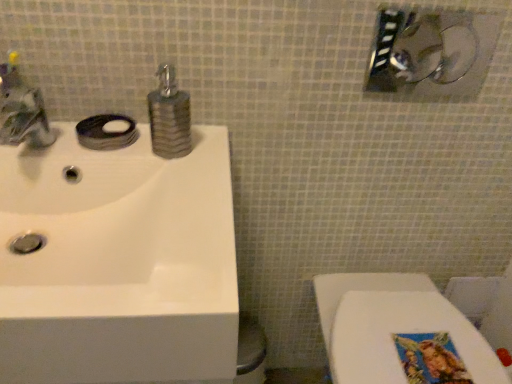
The height and width of the screenshot is (384, 512). What are the coordinates of `vacant space in front of matte silver soap at sink left` in the screenshot? It's located at (115, 156).